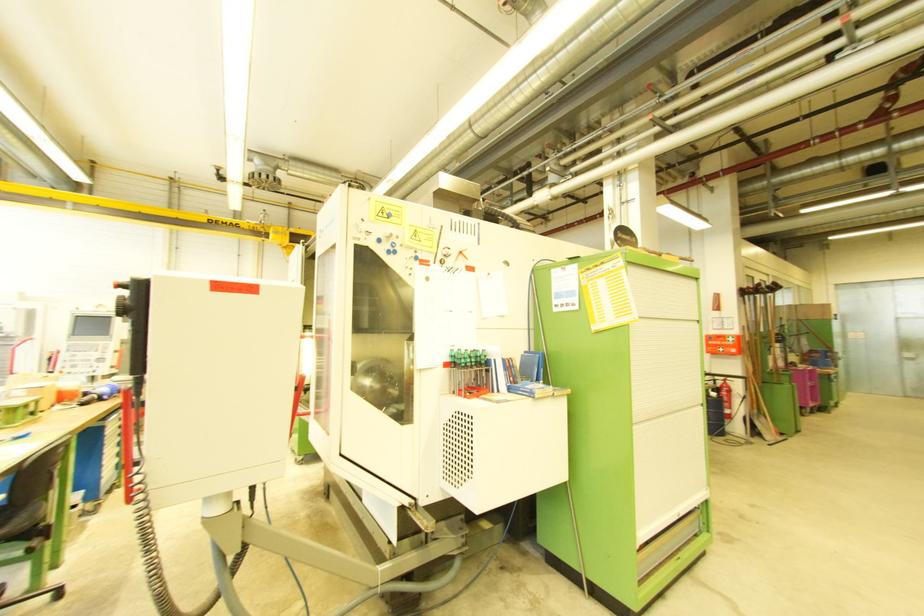
The width and height of the screenshot is (924, 616). Identify the location of green handle screwdriver. (468, 371).